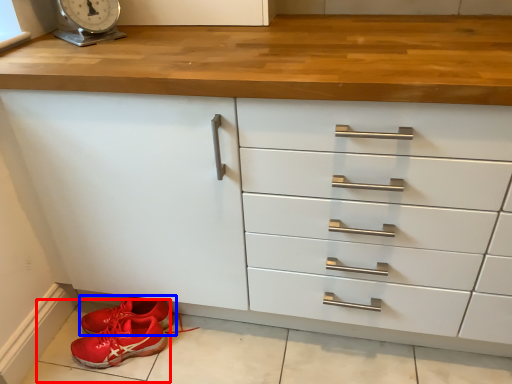
Question: Among these objects, which one is nearest to the camera, tile (highlighted by a red box) or footwear (highlighted by a blue box)?

Choices:
 (A) tile
 (B) footwear

Answer: (A)